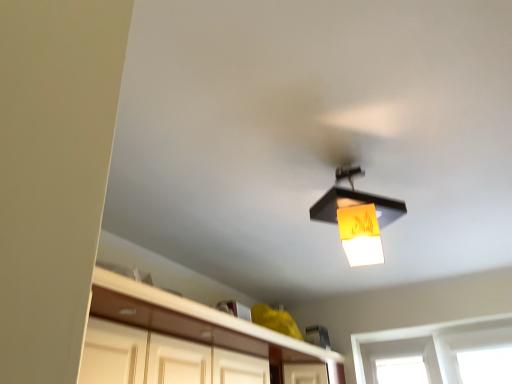
Question: Is the depth of matte black lampshade at upper center greater than that of white glossy cabinetry at lower center?

Choices:
 (A) yes
 (B) no

Answer: (A)

Question: From a real-world perspective, is matte black lampshade at upper center on white glossy cabinetry at lower center?

Choices:
 (A) no
 (B) yes

Answer: (B)

Question: Is white glossy cabinetry at lower center at the back of matte black lampshade at upper center?

Choices:
 (A) yes
 (B) no

Answer: (B)

Question: Is matte black lampshade at upper center shorter than white glossy cabinetry at lower center?

Choices:
 (A) yes
 (B) no

Answer: (B)

Question: From a real-world perspective, is matte black lampshade at upper center beneath white glossy cabinetry at lower center?

Choices:
 (A) no
 (B) yes

Answer: (A)

Question: Does matte black lampshade at upper center have a greater height compared to white glossy cabinetry at lower center?

Choices:
 (A) no
 (B) yes

Answer: (B)

Question: Considering the relative positions of white glossy cabinetry at lower center and matte black lampshade at upper center in the image provided, is white glossy cabinetry at lower center to the right of matte black lampshade at upper center from the viewer's perspective?

Choices:
 (A) no
 (B) yes

Answer: (A)

Question: From a real-world perspective, is white glossy cabinetry at lower center below matte black lampshade at upper center?

Choices:
 (A) yes
 (B) no

Answer: (A)

Question: Can you confirm if white glossy cabinetry at lower center is wider than matte black lampshade at upper center?

Choices:
 (A) yes
 (B) no

Answer: (A)

Question: Does white glossy cabinetry at lower center have a lesser height compared to matte black lampshade at upper center?

Choices:
 (A) no
 (B) yes

Answer: (B)

Question: Would you say white glossy cabinetry at lower center is a long distance from matte black lampshade at upper center?

Choices:
 (A) yes
 (B) no

Answer: (B)

Question: Could matte black lampshade at upper center be considered to be inside white glossy cabinetry at lower center?

Choices:
 (A) no
 (B) yes

Answer: (A)

Question: From the image's perspective, is matte black lampshade at upper center above or below white glossy cabinetry at lower center?

Choices:
 (A) below
 (B) above

Answer: (B)